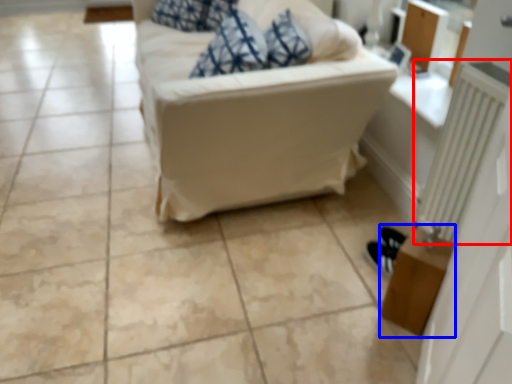
Question: Which object appears farthest to the camera in this image, radiator (highlighted by a red box) or table (highlighted by a blue box)?

Choices:
 (A) radiator
 (B) table

Answer: (B)